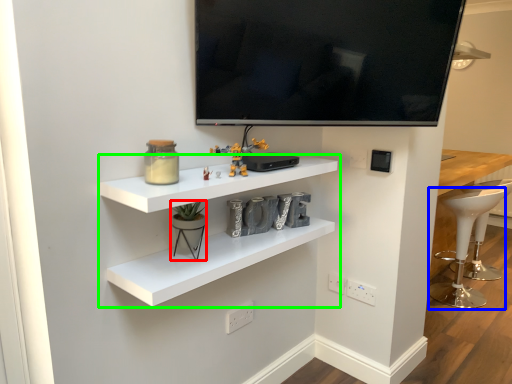
Question: Estimate the real-world distances between objects in this image. Which object is closer to toy (highlighted by a red box), bar stool (highlighted by a blue box) or shelf (highlighted by a green box)?

Choices:
 (A) bar stool
 (B) shelf

Answer: (B)